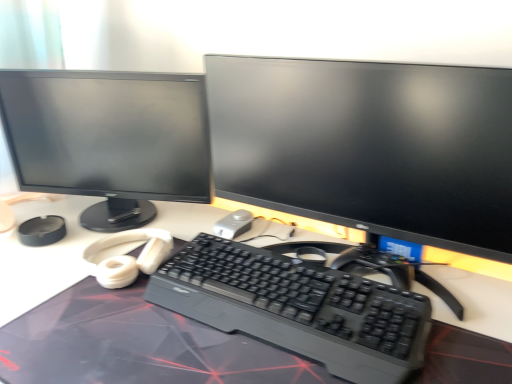
The height and width of the screenshot is (384, 512). What are the coordinates of `blank space above black plastic keyboard at center (from a real-world perspective)` in the screenshot? It's located at (280, 274).